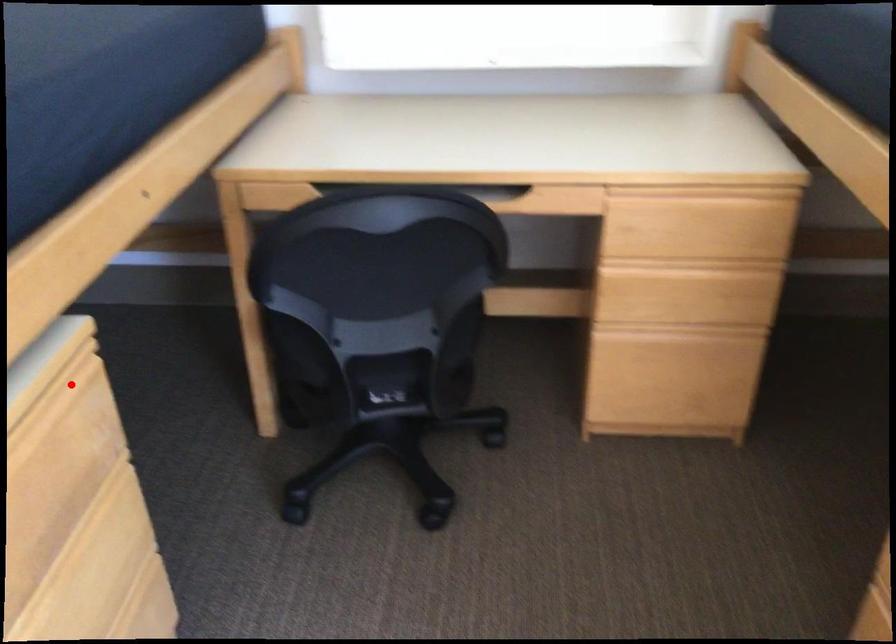
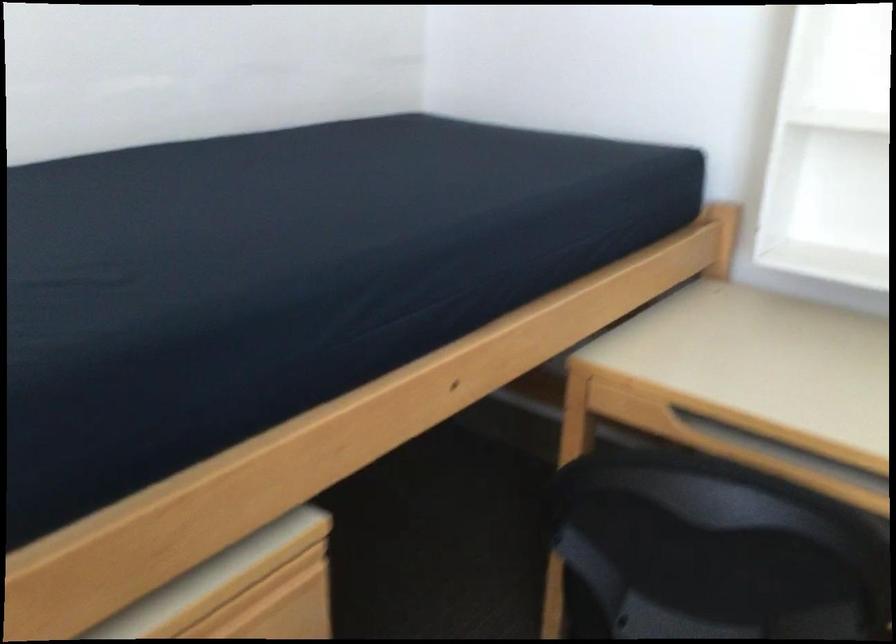
In the second image, find the point that corresponds to the highlighted location in the first image.

(277, 581)